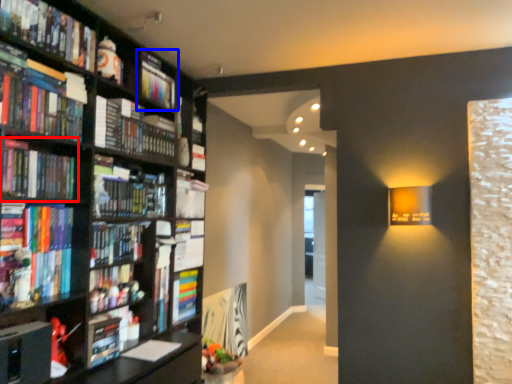
Question: Which point is further to the camera, book (highlighted by a red box) or book (highlighted by a blue box)?

Choices:
 (A) book
 (B) book

Answer: (B)